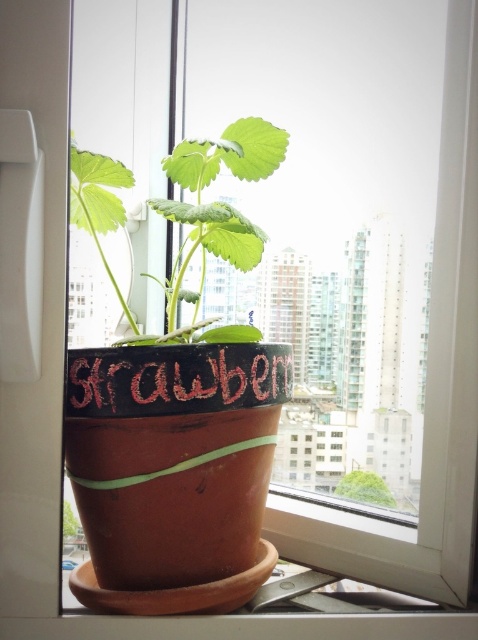
You are a window cleaner who needs to clean the window frame. You have a ladder that can reach up to 1.5 meters. The green matte leafy plant at center and the chalky black sign at center are both in your way. Which object do you need to move first to access the window frame?

The green matte leafy plant at center is taller than the chalky black sign at center, so you should move the green matte leafy plant at center first to access the window frame.

You are standing in front of the window and see the green matte leafy plant at center and the green matte pot at center. Which object is closer to the left side of the window?

The green matte leafy plant at center is closer to the left side of the window because it is positioned to the left of the green matte pot at center.

You are standing in front of the window and want to water the green matte leafy plant at center and the green matte pot at center. Which object should you reach for first to water them in the correct order based on their positions?

You should water the green matte leafy plant at center first because it is closer to you than the green matte pot at center, which is further away.